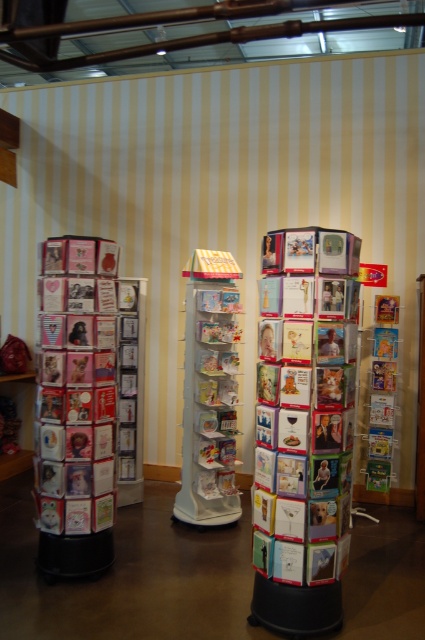
You are a customer in a greeting card shop and want to pick up both the multicolored paper cards at center and the white glossy greeting cards at center. If you can only reach 3 feet, can you reach both without moving?

The distance between the multicolored paper cards at center and white glossy greeting cards at center is 4.50 feet, which is greater than your reach of 3 feet. Therefore, you cannot reach both without moving.

You are a customer in the greeting card shop and want to know if the multicolored paper cards at center are wider than the white glossy greeting cards at center. Can you confirm this?

The multicolored paper cards at center might be wider than white glossy greeting cards at center, so it is possible that they are wider, but there is some uncertainty.